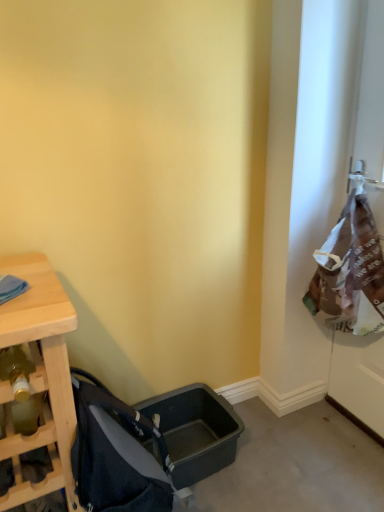
Question: Is brown paper bag at right at the back of dark gray fabric baby carriage at lower left?

Choices:
 (A) no
 (B) yes

Answer: (A)

Question: Are dark gray fabric baby carriage at lower left and brown paper bag at right beside each other?

Choices:
 (A) no
 (B) yes

Answer: (A)

Question: Does dark gray fabric baby carriage at lower left have a greater height compared to brown paper bag at right?

Choices:
 (A) yes
 (B) no

Answer: (B)

Question: Does dark gray fabric baby carriage at lower left have a lesser width compared to brown paper bag at right?

Choices:
 (A) no
 (B) yes

Answer: (A)

Question: Is brown paper bag at right surrounded by dark gray fabric baby carriage at lower left?

Choices:
 (A) no
 (B) yes

Answer: (A)

Question: Considering the relative sizes of dark gray fabric baby carriage at lower left and brown paper bag at right in the image provided, is dark gray fabric baby carriage at lower left bigger than brown paper bag at right?

Choices:
 (A) no
 (B) yes

Answer: (A)

Question: Does brown paper bag at right have a lesser width compared to dark gray fabric baby carriage at lower left?

Choices:
 (A) yes
 (B) no

Answer: (A)

Question: Does brown paper bag at right have a greater width compared to dark gray fabric baby carriage at lower left?

Choices:
 (A) yes
 (B) no

Answer: (B)

Question: Is brown paper bag at right with dark gray fabric baby carriage at lower left?

Choices:
 (A) yes
 (B) no

Answer: (B)

Question: Is dark gray fabric baby carriage at lower left at the back of brown paper bag at right?

Choices:
 (A) no
 (B) yes

Answer: (A)

Question: Is brown paper bag at right bigger than dark gray fabric baby carriage at lower left?

Choices:
 (A) no
 (B) yes

Answer: (B)

Question: Is brown paper bag at right taller than dark gray fabric baby carriage at lower left?

Choices:
 (A) no
 (B) yes

Answer: (B)

Question: From the image's perspective, is brown paper bag at right above or below dark gray fabric baby carriage at lower left?

Choices:
 (A) below
 (B) above

Answer: (B)